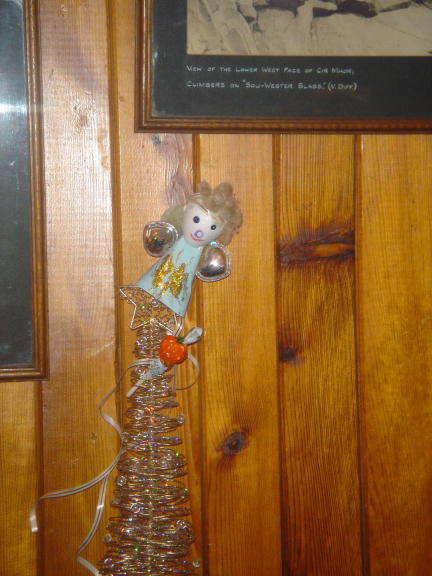
Image resolution: width=432 pixels, height=576 pixels. I want to click on colorful lights, so click(x=151, y=429).